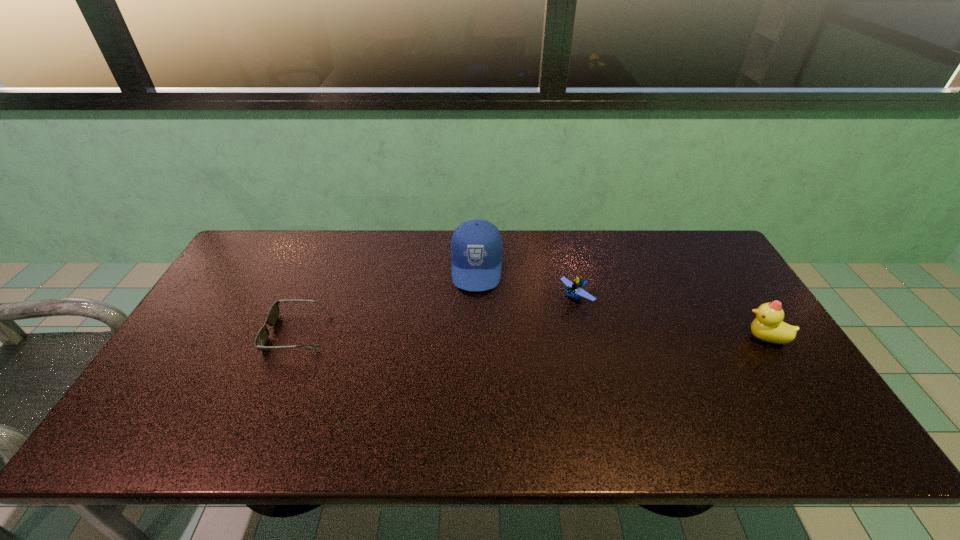
I want to click on free space on the desktop that is between the leftmost object and the duckling and is positioned on the front-facing side of the third tallest object, so click(520, 335).

Image resolution: width=960 pixels, height=540 pixels. I want to click on free space on the desktop that is between the shortest object and the rightmost object and is positioned on the front-facing side of the second object from left to right, so click(474, 334).